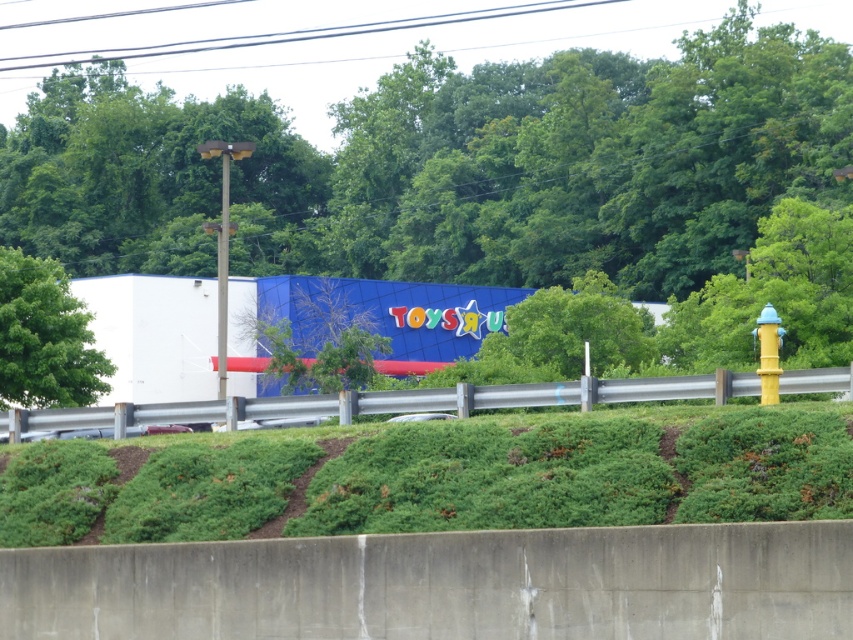
Does green shrubbery at center have a greater width compared to metallic gray guardrail at center?

No.

Is point (732, 451) closer to viewer compared to point (109, 412)?

Yes.

At what (x,y) coordinates should I click in order to perform the action: click on green shrubbery at center. Please return your answer as a coordinate pair (x, y). This screenshot has height=640, width=853. Looking at the image, I should click on (434, 477).

The image size is (853, 640). I want to click on green shrubbery at center, so click(x=434, y=477).

Does green leafy tree at center have a lesser width compared to green shrubbery at center?

No.

Does green leafy tree at center appear on the left side of green shrubbery at center?

Correct, you'll find green leafy tree at center to the left of green shrubbery at center.

Is point (714, 74) in front of point (408, 444)?

No, it is not.

Locate an element on the screen. The height and width of the screenshot is (640, 853). green leafy tree at center is located at coordinates (451, 164).

Does green shrubbery at center appear over green leafy tree at left?

Actually, green shrubbery at center is below green leafy tree at left.

Which is behind, point (347, 484) or point (16, 385)?

Point (16, 385)

At what (x,y) coordinates should I click in order to perform the action: click on green shrubbery at center. Please return your answer as a coordinate pair (x, y). This screenshot has width=853, height=640. Looking at the image, I should click on (434, 477).